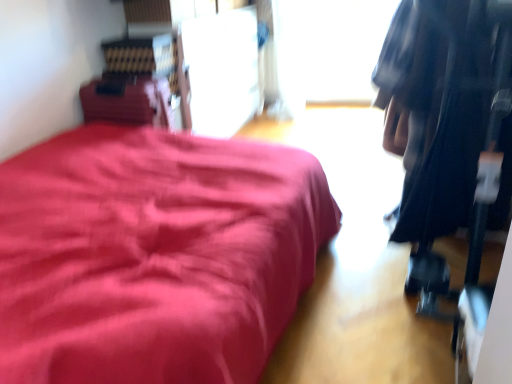
Identify the location of black fabric bag at right. (438, 108).

Image resolution: width=512 pixels, height=384 pixels. What do you see at coordinates (154, 255) in the screenshot?
I see `matte red bed at left` at bounding box center [154, 255].

The image size is (512, 384). In order to click on matte red bed at left in this screenshot , I will do `click(154, 255)`.

Describe the element at coordinates (329, 48) in the screenshot. The width and height of the screenshot is (512, 384). I see `transparent glass window at upper center` at that location.

Image resolution: width=512 pixels, height=384 pixels. I want to click on transparent glass window at upper center, so click(x=329, y=48).

This screenshot has width=512, height=384. I want to click on black fabric bag at right, so click(438, 108).

Is there a large distance between transparent glass window at upper center and black fabric bag at right?

Absolutely, transparent glass window at upper center is distant from black fabric bag at right.

In terms of height, does transparent glass window at upper center look taller or shorter compared to black fabric bag at right?

Clearly, transparent glass window at upper center is shorter compared to black fabric bag at right.

Based on the photo, between transparent glass window at upper center and black fabric bag at right, which one appears on the right side from the viewer's perspective?

From the viewer's perspective, black fabric bag at right appears more on the right side.

In the image, is transparent glass window at upper center positioned in front of or behind black fabric bag at right?

Visually, transparent glass window at upper center is located behind black fabric bag at right.

Between point (28, 213) and point (455, 175), which one is positioned behind?

The point (455, 175) is farther.

From a real-world perspective, who is located higher, matte red bed at left or black fabric bag at right?

black fabric bag at right.

Which object is closer to the camera taking this photo, matte red bed at left or black fabric bag at right?

Positioned in front is matte red bed at left.

Is matte red bed at left with transparent glass window at upper center?

matte red bed at left and transparent glass window at upper center are not in contact.

Where is `furniture in front of the transparent glass window at upper center`? furniture in front of the transparent glass window at upper center is located at coordinates (154, 255).

Does matte red bed at left have a greater height compared to transparent glass window at upper center?

In fact, matte red bed at left may be shorter than transparent glass window at upper center.

From a real-world perspective, who is located higher, matte red bed at left or transparent glass window at upper center?

From a 3D spatial view, transparent glass window at upper center is above.

Does black fabric bag at right have a lesser width compared to matte red bed at left?

Correct, the width of black fabric bag at right is less than that of matte red bed at left.

From a real-world perspective, between black fabric bag at right and matte red bed at left, who is vertically lower?

matte red bed at left is physically lower.

Considering the sizes of objects black fabric bag at right and matte red bed at left in the image provided, who is taller, black fabric bag at right or matte red bed at left?

Standing taller between the two is black fabric bag at right.

How many degrees apart are the facing directions of black fabric bag at right and transparent glass window at upper center?

The angular difference between black fabric bag at right and transparent glass window at upper center is 91.1 degrees.

From a real-world perspective, does black fabric bag at right sit lower than transparent glass window at upper center?

No, from a real-world perspective, black fabric bag at right is not below transparent glass window at upper center.

Which of these two, black fabric bag at right or transparent glass window at upper center, stands taller?

Standing taller between the two is black fabric bag at right.

Is black fabric bag at right positioned with its back to transparent glass window at upper center?

No, black fabric bag at right is not facing away from transparent glass window at upper center.

How distant is transparent glass window at upper center from matte red bed at left?

They are 2.74 meters apart.

Which of these two, transparent glass window at upper center or matte red bed at left, is smaller?

transparent glass window at upper center.

Is point (327, 66) less distant than point (49, 167)?

No, (327, 66) is further to viewer.

Which object is thinner, transparent glass window at upper center or matte red bed at left?

transparent glass window at upper center is thinner.

Where is `clothing located below the transparent glass window at upper center (from the image's perspective)`? This screenshot has width=512, height=384. clothing located below the transparent glass window at upper center (from the image's perspective) is located at coordinates (438, 108).

I want to click on clothing above the matte red bed at left (from a real-world perspective), so click(x=438, y=108).

Looking at the image, which one is located further to transparent glass window at upper center, matte red bed at left or black fabric bag at right?

matte red bed at left lies further to transparent glass window at upper center than the other object.

Looking at the image, which one is located closer to matte red bed at left, transparent glass window at upper center or black fabric bag at right?

black fabric bag at right is closer to matte red bed at left.

Estimate the real-world distances between objects in this image. Which object is further from black fabric bag at right, transparent glass window at upper center or matte red bed at left?

The object further to black fabric bag at right is transparent glass window at upper center.

When comparing their distances from matte red bed at left, does black fabric bag at right or transparent glass window at upper center seem further?

transparent glass window at upper center is positioned further to the anchor matte red bed at left.

Considering their positions, is black fabric bag at right positioned closer to transparent glass window at upper center than matte red bed at left?

black fabric bag at right is closer to transparent glass window at upper center.

Based on their spatial positions, is matte red bed at left or transparent glass window at upper center further from black fabric bag at right?

transparent glass window at upper center lies further to black fabric bag at right than the other object.

This screenshot has width=512, height=384. In order to click on clothing between matte red bed at left and transparent glass window at upper center from front to back in this screenshot , I will do `click(438, 108)`.